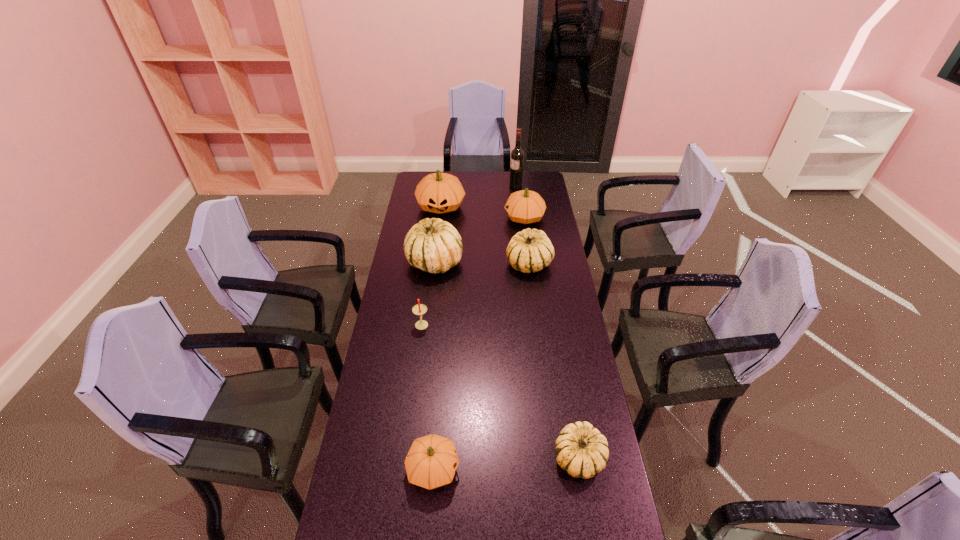
Where is `vacant region between the smallest white gourd and the rightmost orange gourd`? The image size is (960, 540). vacant region between the smallest white gourd and the rightmost orange gourd is located at coordinates point(552,338).

Image resolution: width=960 pixels, height=540 pixels. In order to click on free area in between the second smallest orange gourd and the biggest orange gourd in this screenshot , I will do `click(483, 212)`.

The height and width of the screenshot is (540, 960). I want to click on free area in between the nearest white gourd and the farthest object, so click(547, 322).

You are a GUI agent. You are given a task and a screenshot of the screen. Output one action in this format:
    pyautogui.click(x=<x>, y=<y>)
    Task: Click on the free area in between the candle and the farthest object
    The image size is (960, 540).
    Given the screenshot: What is the action you would take?
    pyautogui.click(x=468, y=255)

The height and width of the screenshot is (540, 960). I want to click on vacant space that is in between the smallest orange gourd and the nearest white gourd, so click(506, 463).

The width and height of the screenshot is (960, 540). What are the coordinates of `free space between the leftmost white gourd and the smallest white gourd` in the screenshot? It's located at (507, 360).

I want to click on free spot between the second smallest white gourd and the leftmost white gourd, so click(x=482, y=263).

Find the location of `unoccupied position between the biggest orange gourd and the tallest object`. unoccupied position between the biggest orange gourd and the tallest object is located at coordinates (478, 196).

Find the location of a particular element. The width and height of the screenshot is (960, 540). object that stands as the fifth closest to the candle is located at coordinates (439, 193).

The image size is (960, 540). In order to click on object that ranks as the fifth closest to the nearest orange gourd in this screenshot , I will do 525,206.